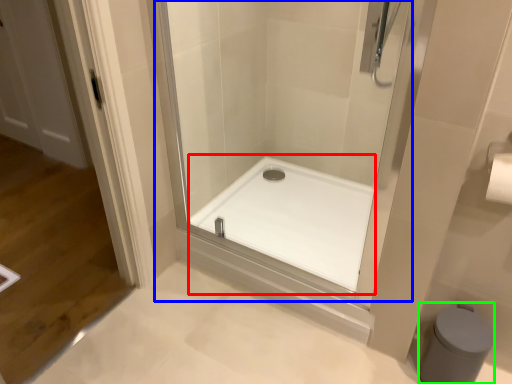
Question: Based on their relative distances, which object is farther from bath (highlighted by a red box)? Choose from shower door (highlighted by a blue box) and bidet (highlighted by a green box).

Choices:
 (A) shower door
 (B) bidet

Answer: (B)